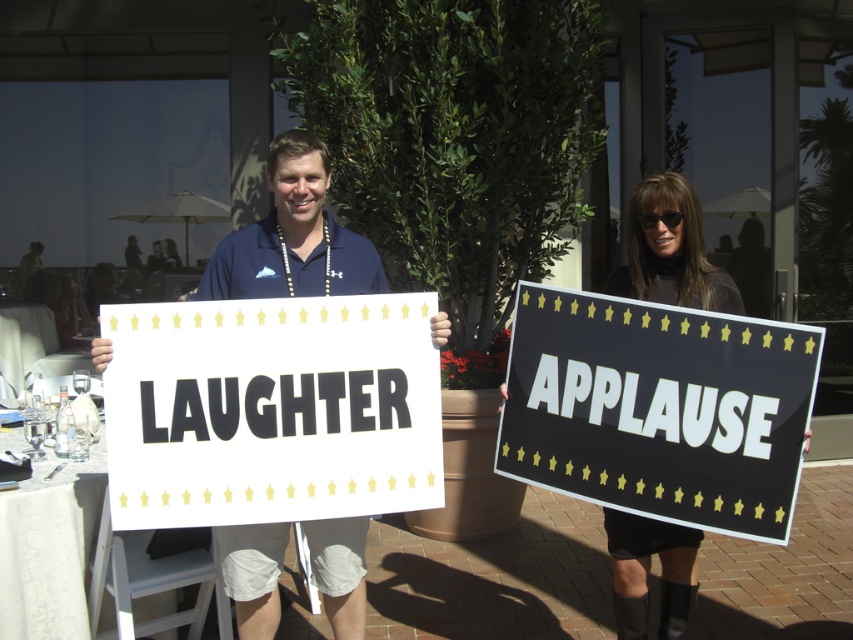
You are standing at the origin point in the image. The black matte sign at right is represented by the point with coordinates (659, 410). If you want to walk directly towards the black matte sign at right, which direction should you move?

The coordinates of the black matte sign at right are 0.641 on the x axis and 0.773 on the y axis. Since the origin is at the bottom left corner of the image, moving towards higher x values means moving to the right, and higher y values mean moving upwards. Therefore, to reach the black matte sign at right, you should move to the right and upwards.

You are taking a photo of two points in the scene described. The first point is at coordinates point (173, 422) and the second is at point (631, 259). Which point will appear larger in your photo?

Point (173, 422) is closer to the camera than point (631, 259), so it will appear larger in the photo.

From the picture: You are a photographer at the event and need to capture both the white paper sign at center and the black leather boots at lower right in a single frame. Based on their positions, which object should you focus on first to ensure both are in the frame?

The white paper sign at center is positioned on the left side of black leather boots at lower right, so you should focus on the black leather boots at lower right first to ensure both are included in the frame.